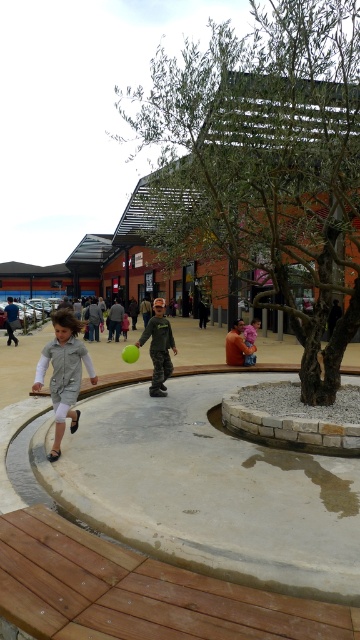
Question: Does green matte shirt at center come in front of light gray fabric jacket at center?

Choices:
 (A) no
 (B) yes

Answer: (B)

Question: Can you confirm if green matte shirt at center is positioned to the left of light gray fabric jacket at center?

Choices:
 (A) yes
 (B) no

Answer: (A)

Question: Estimate the real-world distances between objects in this image. Which object is closer to the light gray fabric jacket at center?

Choices:
 (A) green matte shirt at center
 (B) light gray fabric jacket at left

Answer: (A)

Question: Which object appears closest to the camera in this image?

Choices:
 (A) light gray fabric jacket at center
 (B) green matte shirt at center
 (C) light gray fabric jacket at left

Answer: (C)

Question: Can you confirm if green matte shirt at center is positioned to the left of light gray fabric jacket at center?

Choices:
 (A) yes
 (B) no

Answer: (A)

Question: Which of the following is the farthest from the observer?

Choices:
 (A) light gray fabric jacket at center
 (B) light gray fabric jacket at left

Answer: (A)